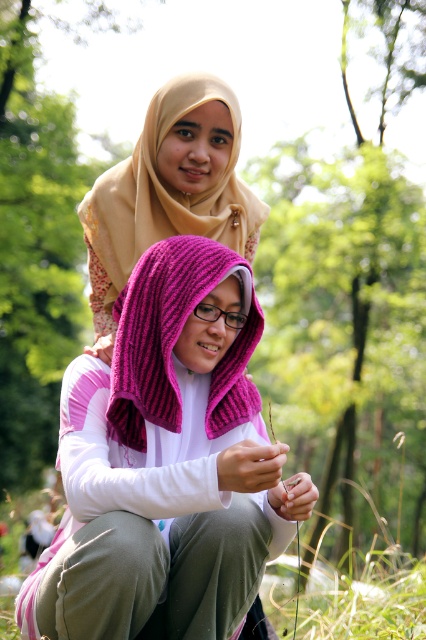
Question: Can you confirm if fuchsia knitted shawl at lower center is thinner than beige soft scarf at upper center?

Choices:
 (A) yes
 (B) no

Answer: (A)

Question: Is fuchsia knitted shawl at lower center closer to the viewer compared to beige soft scarf at upper center?

Choices:
 (A) yes
 (B) no

Answer: (A)

Question: Is fuchsia knitted shawl at lower center wider than beige soft scarf at upper center?

Choices:
 (A) yes
 (B) no

Answer: (B)

Question: Among these objects, which one is farthest from the camera?

Choices:
 (A) beige soft scarf at upper center
 (B) fuchsia knitted shawl at lower center

Answer: (A)